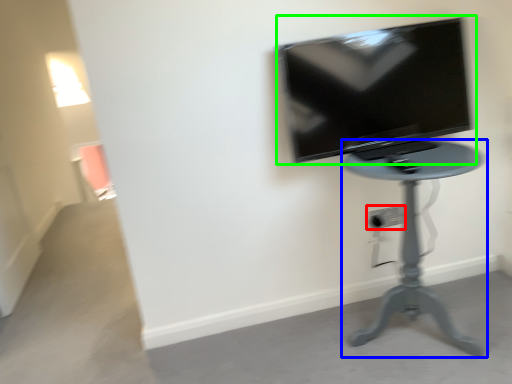
Question: Based on their relative distances, which object is farther from electric outlet (highlighted by a red box)? Choose from furniture (highlighted by a blue box) and television (highlighted by a green box).

Choices:
 (A) furniture
 (B) television

Answer: (B)